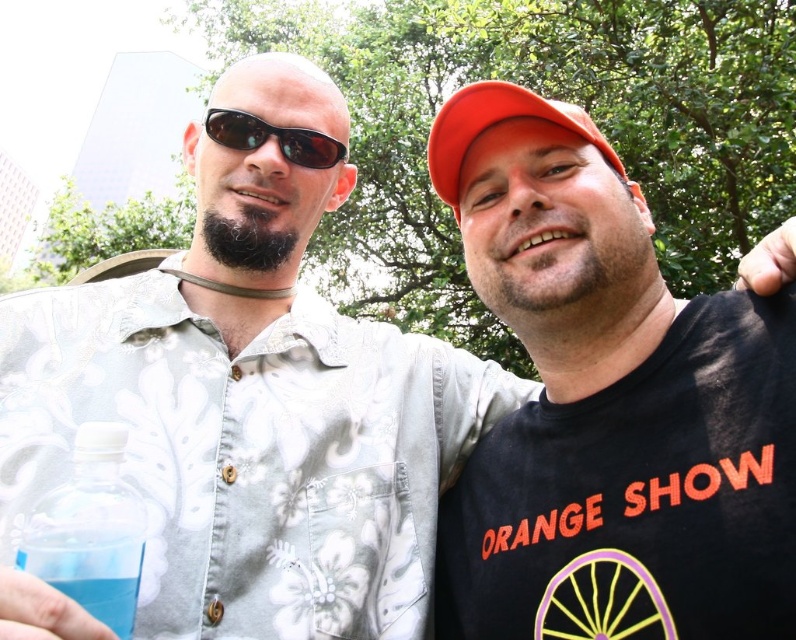
Identify the location of orange matte baseball hat at upper right. (494, 124).

Is orange matte baseball hat at upper right thinner than translucent plastic bottle at lower left?

No.

Which is behind, point (544, 109) or point (37, 573)?

Point (544, 109)

Image resolution: width=796 pixels, height=640 pixels. Identify the location of orange matte baseball hat at upper right. (494, 124).

Does transparent plastic bottle at lower left have a lesser width compared to black reflective sunglasses at upper left?

Yes, transparent plastic bottle at lower left is thinner than black reflective sunglasses at upper left.

Is transparent plastic bottle at lower left shorter than black reflective sunglasses at upper left?

No, transparent plastic bottle at lower left is not shorter than black reflective sunglasses at upper left.

Where is `transparent plastic bottle at lower left`? transparent plastic bottle at lower left is located at coordinates (90, 531).

Looking at this image, can you confirm if transparent plastic bottle at lower left is positioned below orange matte baseball hat at upper right?

Correct, transparent plastic bottle at lower left is located below orange matte baseball hat at upper right.

Who is more forward, (100, 552) or (457, 96)?

Point (100, 552) is in front.

Image resolution: width=796 pixels, height=640 pixels. Find the location of `transparent plastic bottle at lower left`. transparent plastic bottle at lower left is located at coordinates (90, 531).